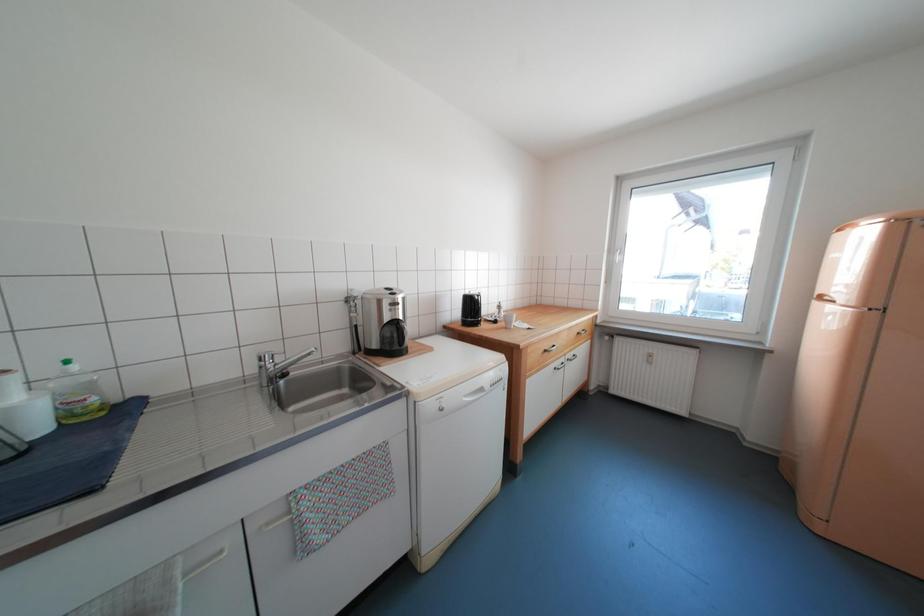
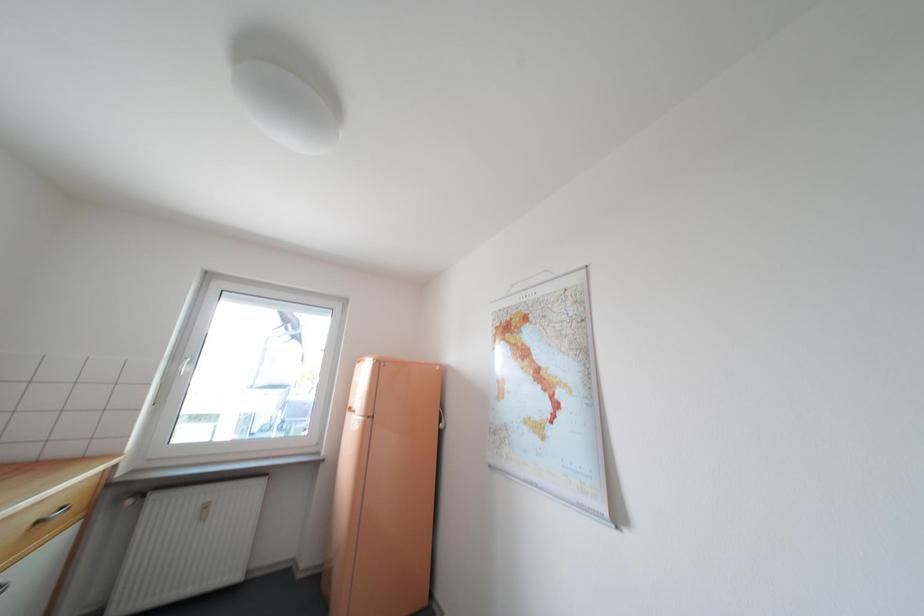
First-person continuous shooting, in which direction is the camera rotating?

The camera rotated toward right-up.